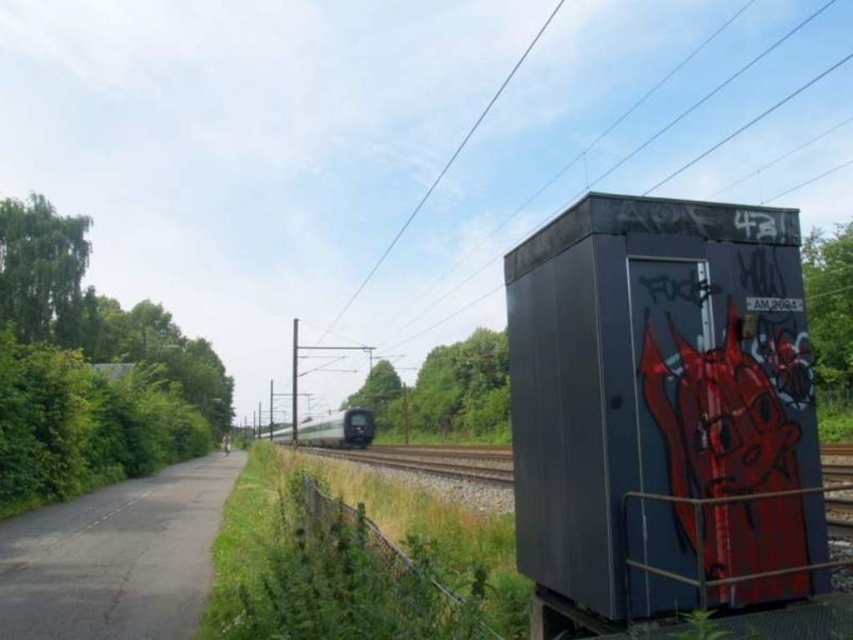
You are a railway engineer inspecting the tracks. You need to ensure the silver metallic train at center can fit on the smooth metal train track at center. Based on the scene, will the train fit on the track?

The smooth metal train track at center has a larger width than the silver metallic train at center, so the train will fit on the track.